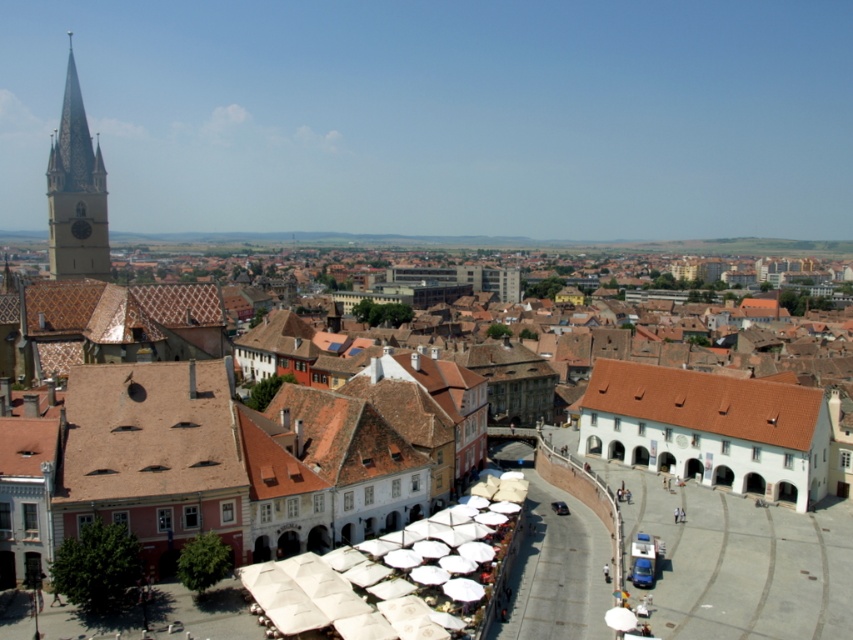
Looking at this image, does white fabric umbrella at center have a smaller size compared to matte stone clock tower at upper left?

Indeed, white fabric umbrella at center has a smaller size compared to matte stone clock tower at upper left.

Does white fabric umbrella at center have a greater width compared to matte stone clock tower at upper left?

No.

Between point (502, 522) and point (57, 264), which one is positioned behind?

The point (57, 264) is more distant.

Where is `white fabric umbrella at center`? The width and height of the screenshot is (853, 640). white fabric umbrella at center is located at coordinates (396, 573).

What do you see at coordinates (698, 557) in the screenshot? The width and height of the screenshot is (853, 640). I see `matte white umbrellas at center` at bounding box center [698, 557].

Who is shorter, matte white umbrellas at center or matte stone clock tower at upper left?

matte white umbrellas at center is shorter.

You are a GUI agent. You are given a task and a screenshot of the screen. Output one action in this format:
    pyautogui.click(x=<x>, y=<y>)
    Task: Click on the matte white umbrellas at center
    The height and width of the screenshot is (640, 853).
    Given the screenshot: What is the action you would take?
    pyautogui.click(x=698, y=557)

How distant is white fabric umbrella at center from matte white umbrellas at center?

white fabric umbrella at center and matte white umbrellas at center are 28.34 meters apart.

Can you confirm if white fabric umbrella at center is positioned to the left of matte white umbrellas at center?

Correct, you'll find white fabric umbrella at center to the left of matte white umbrellas at center.

Does point (408, 634) come behind point (689, 349)?

No, (408, 634) is in front of (689, 349).

Identify the location of white fabric umbrella at center. (396, 573).